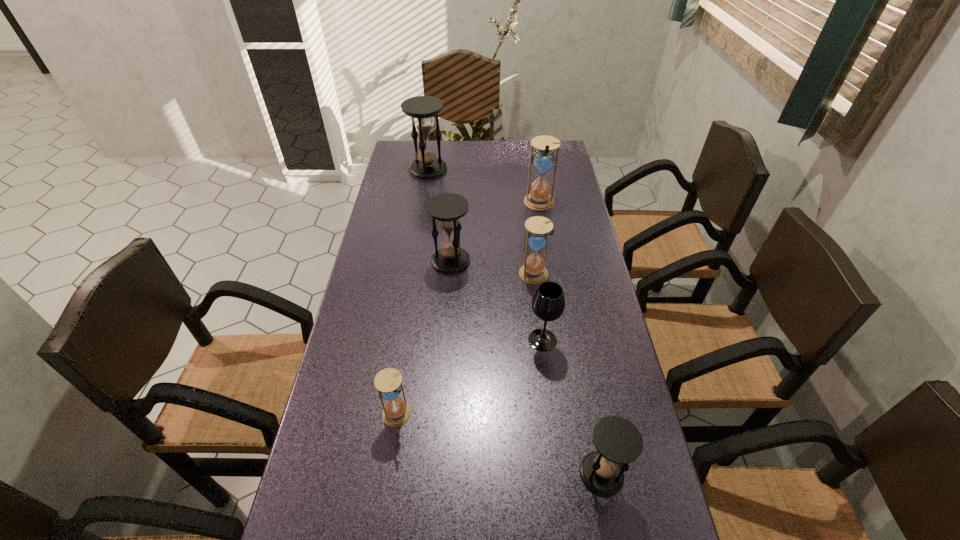
Where is `vacant space in between the farthest white hourglass and the leftmost white hourglass`? The image size is (960, 540). vacant space in between the farthest white hourglass and the leftmost white hourglass is located at coordinates (468, 309).

I want to click on vacant space in between the second smallest black hourglass and the nearest black hourglass, so click(x=526, y=367).

Choose which object is the nearest neighbor to the wineglass. Please provide its 2D coordinates. Your answer should be formatted as a tuple, i.e. [(x, y)], where the tuple contains the x and y coordinates of a point satisfying the conditions above.

[(538, 227)]

You are a GUI agent. You are given a task and a screenshot of the screen. Output one action in this format:
    pyautogui.click(x=<x>, y=<y>)
    Task: Click on the object that is the closest one to the biggest white hourglass
    The width and height of the screenshot is (960, 540).
    Given the screenshot: What is the action you would take?
    pyautogui.click(x=538, y=227)

The image size is (960, 540). Identify the location of hourglass that stands as the second closest to the rightmost black hourglass. (538, 227).

What are the coordinates of `hourglass that can be found as the fourth closest to the second farthest object` in the screenshot? It's located at (388, 382).

This screenshot has width=960, height=540. What are the coordinates of `black hourglass that is the second closest one to the biggest black hourglass` in the screenshot? It's located at (618, 442).

Select which black hourglass is the closest to the leftmost white hourglass. Please provide its 2D coordinates. Your answer should be formatted as a tuple, i.e. [(x, y)], where the tuple contains the x and y coordinates of a point satisfying the conditions above.

[(618, 442)]

Point out which white hourglass is positioned as the nearest to the smallest black hourglass. Please provide its 2D coordinates. Your answer should be formatted as a tuple, i.e. [(x, y)], where the tuple contains the x and y coordinates of a point satisfying the conditions above.

[(388, 382)]

Locate an element on the screen. The height and width of the screenshot is (540, 960). white hourglass that is the second closest to the second nearest object is located at coordinates (539, 198).